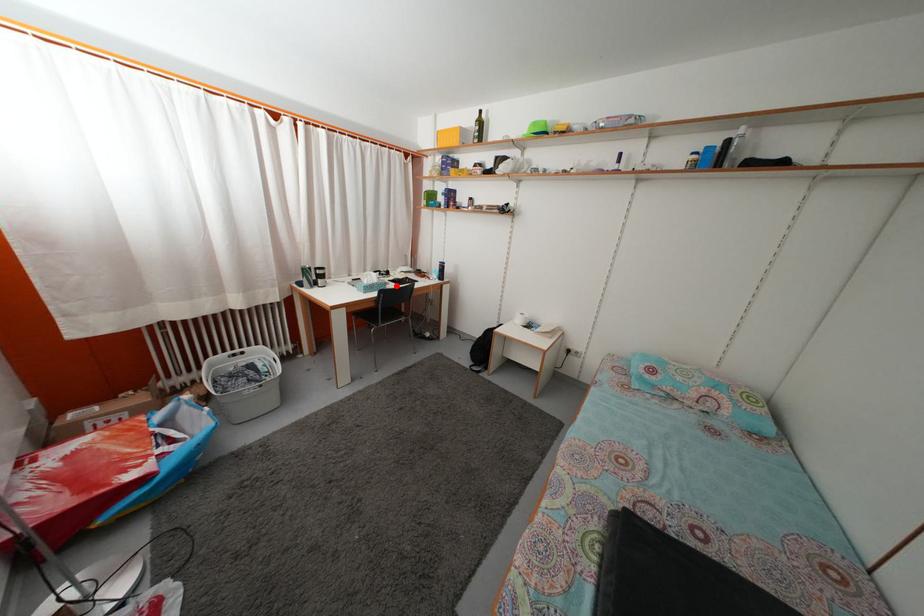
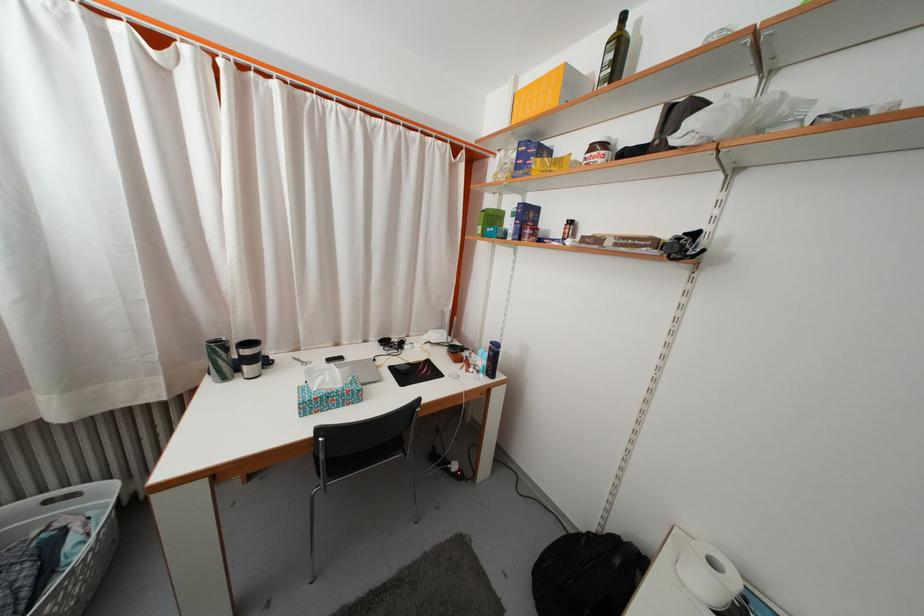
Locate, in the second image, the point that corresponds to the highlighted location in the first image.

(402, 369)